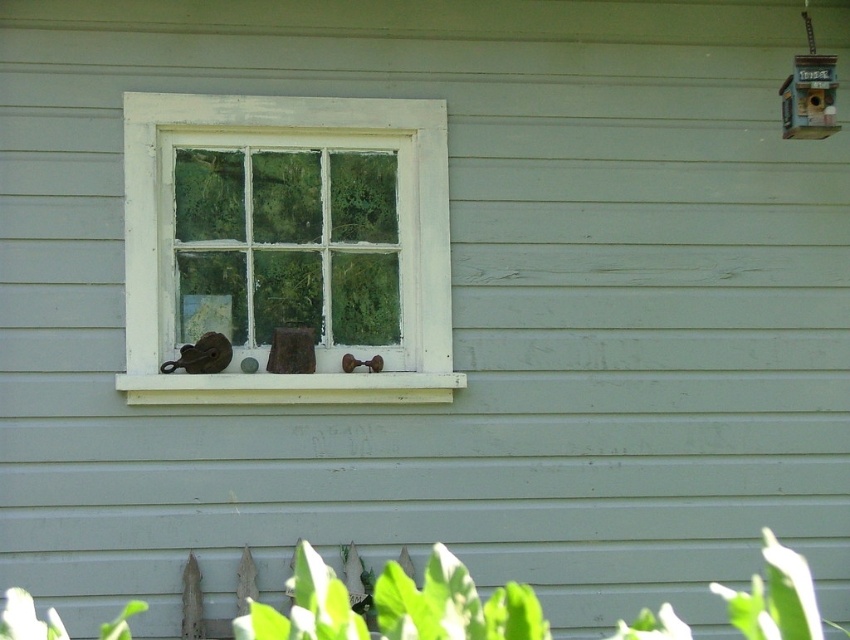
From the picture: You are a painter who needs to paint the white painted wood window frame at center and the white painted wood at center. You have a 12 inch long brush. Can you reach both objects with the same brush without moving your position?

The white painted wood window frame at center and white painted wood at center are 8.89 inches apart from each other. Since your brush is 12 inches long, which is longer than the distance between them, you can reach both objects with the same brush without moving your position.

You are an architect inspecting the light green wooden house. You need to determine the spatial relationship between the white painted wood window frame at center and the white painted wood at center. Which one is wider?

The white painted wood window frame at center has a lesser width compared to the white painted wood at center, so the white painted wood at center is wider.

You are standing in front of the house and want to place a new decoration between the two points, point (434, 342) and point (242, 378). Which point should the decoration be closer to so it doesn t block the view of the birdhouse?

The decoration should be closer to point (242, 378) because point (434, 342) is behind it, so placing the decoration near the front point won t block the view of the birdhouse.